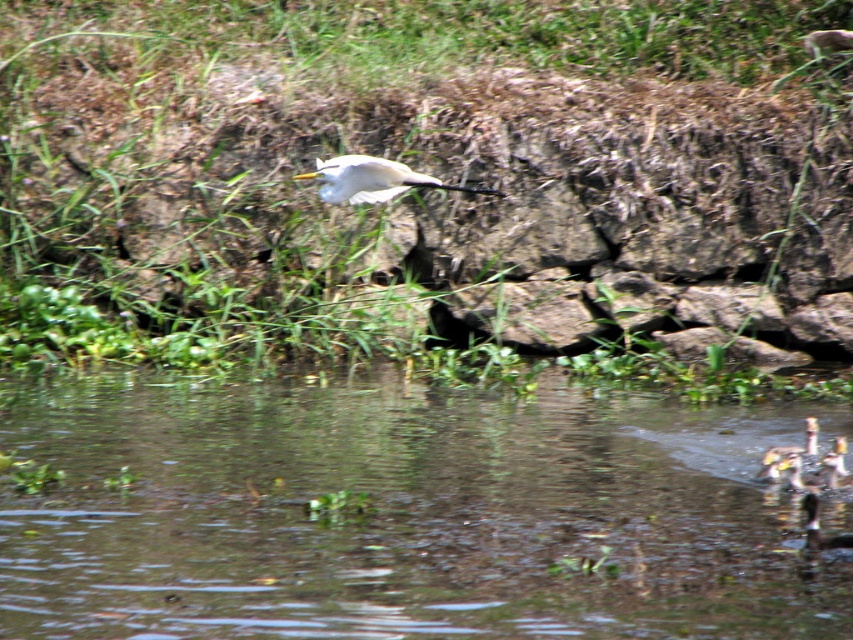
You are a photographer trying to capture the white glossy bird at center while avoiding the clear water at lower center. Based on their positions, can you determine if the bird is above or below the water level?

The clear water at lower center is taller than the white glossy bird at center, which means the bird is below the water level.

You are standing at the edge of the water and see the clear water at lower center and the white feathered bird at lower right. Which object is closer to you?

The clear water at lower center is much taller as white feathered bird at lower right, so the white feathered bird at lower right is closer to you.